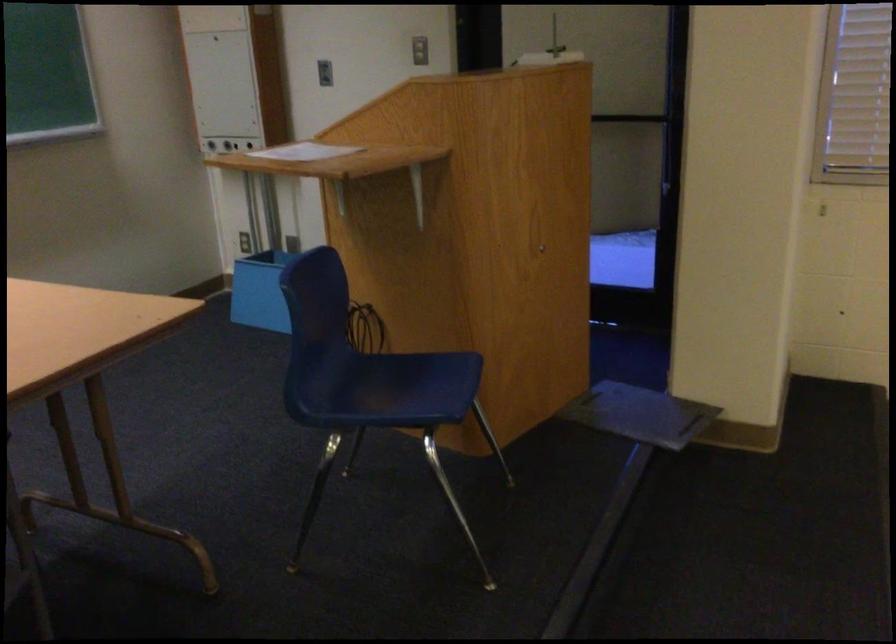
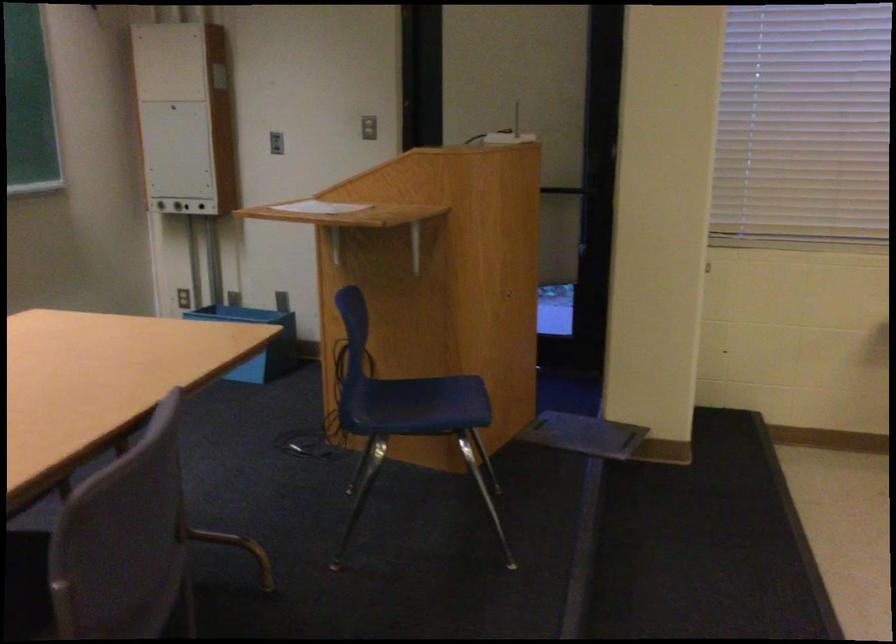
Find the pixel in the second image that matches (408,379) in the first image.

(424, 398)